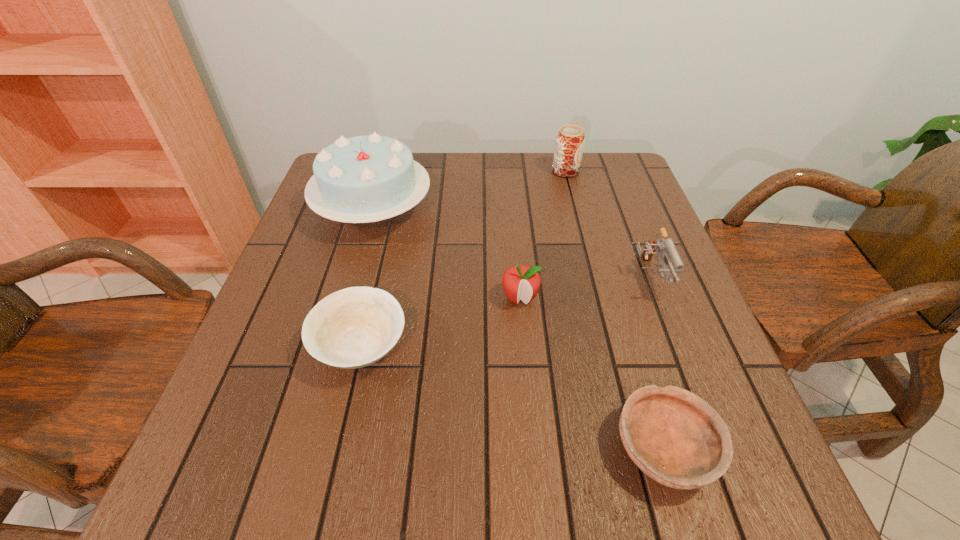
In the image, there is a desktop. Where is `vacant space at the near right corner`? vacant space at the near right corner is located at coordinates (725, 492).

Locate an element on the screen. free area in between the gun and the third object from left to right is located at coordinates (585, 288).

Locate an element on the screen. The width and height of the screenshot is (960, 540). vacant space that is in between the tallest object and the farther bowl is located at coordinates (368, 279).

Find the location of a particular element. The width and height of the screenshot is (960, 540). free space between the birthday cake and the gun is located at coordinates (511, 244).

Where is `free space between the gun and the left bowl`? free space between the gun and the left bowl is located at coordinates (505, 312).

What are the coordinates of `empty location between the farther bowl and the apple` in the screenshot? It's located at (441, 323).

Image resolution: width=960 pixels, height=540 pixels. I want to click on unoccupied area between the beer can and the third shortest object, so click(542, 235).

What are the coordinates of `vacant space that is in between the farther bowl and the gun` in the screenshot? It's located at (505, 312).

Where is `free area in between the gun and the beer can`? The height and width of the screenshot is (540, 960). free area in between the gun and the beer can is located at coordinates (607, 224).

Locate an element on the screen. free area in between the birthday cake and the third shortest object is located at coordinates (446, 254).